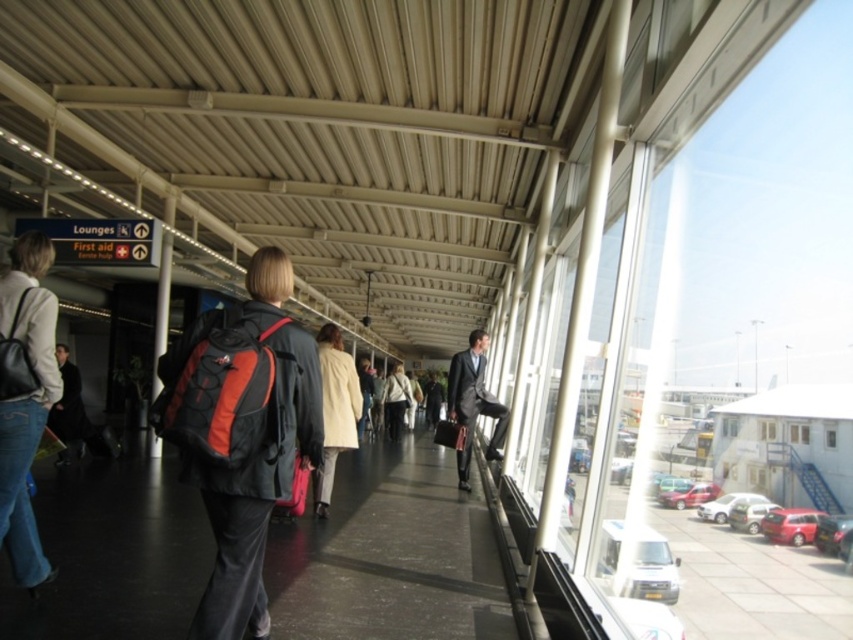
Question: Which object appears farthest from the camera in this image?

Choices:
 (A) denim jacket at left
 (B) light beige jacket at center
 (C) light beige coat at center
 (D) matte black suit at center

Answer: (B)

Question: Among these objects, which one is nearest to the camera?

Choices:
 (A) matte black suit at center
 (B) light beige coat at center
 (C) denim jacket at left
 (D) light beige jacket at center

Answer: (C)

Question: Does matte black backpack at center appear over matte black suit at center?

Choices:
 (A) yes
 (B) no

Answer: (A)

Question: Which object appears closest to the camera in this image?

Choices:
 (A) denim jacket at left
 (B) light beige jacket at center

Answer: (A)

Question: Does matte black backpack at center appear under matte black suit at center?

Choices:
 (A) yes
 (B) no

Answer: (B)

Question: Is matte black backpack at center above light beige coat at center?

Choices:
 (A) yes
 (B) no

Answer: (A)